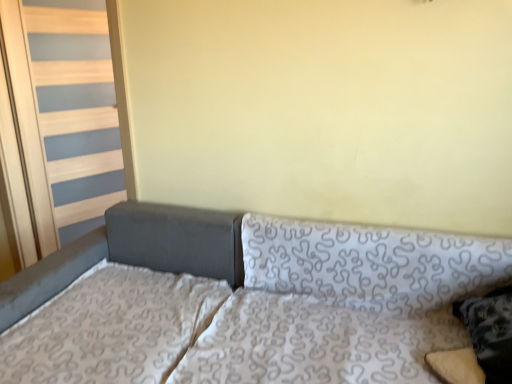
Question: From the image's perspective, is patterned fabric mattress at lower left located beneath patterned fabric studio couch at center?

Choices:
 (A) no
 (B) yes

Answer: (A)

Question: Considering the relative sizes of patterned fabric mattress at lower left and patterned fabric studio couch at center in the image provided, is patterned fabric mattress at lower left smaller than patterned fabric studio couch at center?

Choices:
 (A) yes
 (B) no

Answer: (A)

Question: Is the depth of patterned fabric mattress at lower left greater than that of patterned fabric studio couch at center?

Choices:
 (A) yes
 (B) no

Answer: (A)

Question: Is patterned fabric mattress at lower left in front of patterned fabric studio couch at center?

Choices:
 (A) yes
 (B) no

Answer: (B)

Question: Considering the relative sizes of patterned fabric mattress at lower left and patterned fabric studio couch at center in the image provided, is patterned fabric mattress at lower left thinner than patterned fabric studio couch at center?

Choices:
 (A) yes
 (B) no

Answer: (A)

Question: Which is correct: patterned fabric mattress at lower left is inside patterned fabric pillow at right, or outside of it?

Choices:
 (A) outside
 (B) inside

Answer: (A)

Question: Considering the positions of point [x=84, y=291] and point [x=487, y=347], is point [x=84, y=291] closer or farther from the camera than point [x=487, y=347]?

Choices:
 (A) farther
 (B) closer

Answer: (A)

Question: Is patterned fabric mattress at lower left bigger or smaller than patterned fabric pillow at right?

Choices:
 (A) big
 (B) small

Answer: (A)

Question: Considering the positions of patterned fabric mattress at lower left and patterned fabric pillow at right in the image, is patterned fabric mattress at lower left taller or shorter than patterned fabric pillow at right?

Choices:
 (A) tall
 (B) short

Answer: (B)

Question: From a real-world perspective, is patterned fabric studio couch at center positioned above or below patterned fabric mattress at lower left?

Choices:
 (A) above
 (B) below

Answer: (B)

Question: Relative to patterned fabric mattress at lower left, is patterned fabric studio couch at center in front or behind?

Choices:
 (A) behind
 (B) front

Answer: (B)

Question: Considering the positions of patterned fabric studio couch at center and patterned fabric mattress at lower left in the image, is patterned fabric studio couch at center wider or thinner than patterned fabric mattress at lower left?

Choices:
 (A) wide
 (B) thin

Answer: (A)

Question: Looking at the image, does patterned fabric studio couch at center seem bigger or smaller compared to patterned fabric mattress at lower left?

Choices:
 (A) big
 (B) small

Answer: (A)

Question: From the image's perspective, is patterned fabric mattress at lower left above or below patterned fabric studio couch at center?

Choices:
 (A) above
 (B) below

Answer: (A)

Question: Relative to patterned fabric studio couch at center, is patterned fabric mattress at lower left in front or behind?

Choices:
 (A) front
 (B) behind

Answer: (B)